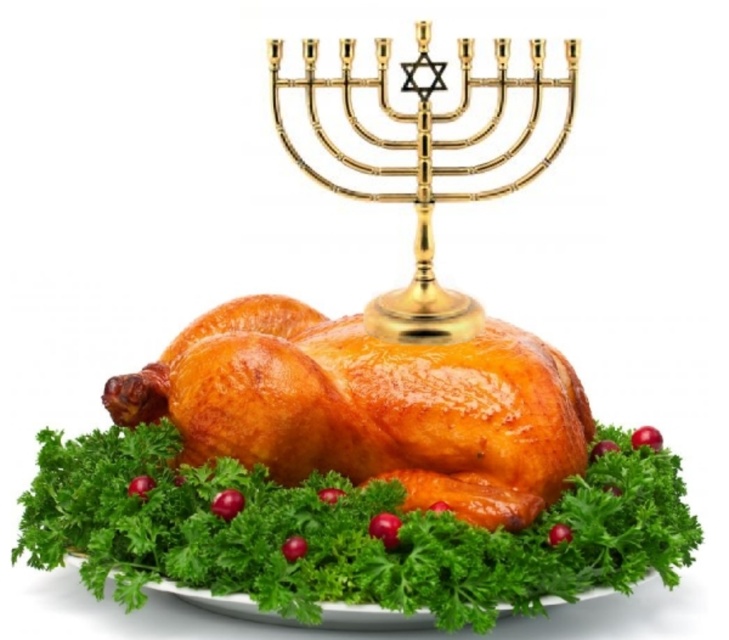
You are a guest at a holiday dinner and want to take a photo of the golden crispy turkey at center and the gold polished menorah at upper center. Which one should you focus on first if you want to capture both in one shot?

You should focus on the gold polished menorah at upper center first because it is above the golden crispy turkey at center, so adjusting focus from top to bottom will help capture both in one shot.

You are a photographer taking a closeup shot of the roasted chicken. There are two points of interest marked on the image at coordinates point (x=448, y=456) and point (x=496, y=70). Which point is closer to your camera lens?

Point (x=448, y=456) is closer to the camera lens than point (x=496, y=70).

You are a guest at a holiday dinner and want to take a photo of the golden crispy turkey at center and the gold polished menorah at upper center. Which object should you focus on first to ensure both are in the frame without moving the camera?

You should focus on the golden crispy turkey at center first because it is in front of the gold polished menorah at upper center, so keeping it in focus will naturally include the menorah in the background.